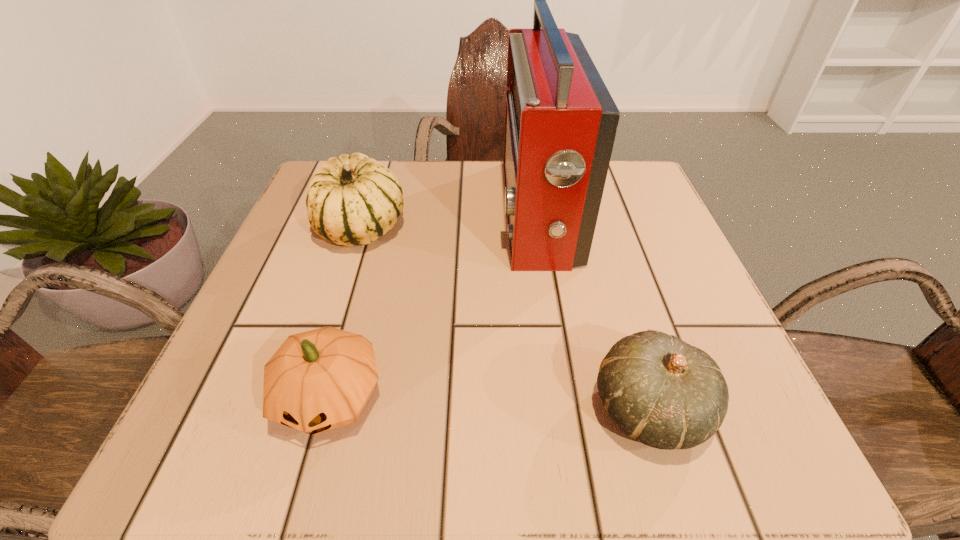
The width and height of the screenshot is (960, 540). What are the coordinates of `vacant space at the far right corner of the desktop` in the screenshot? It's located at (617, 185).

This screenshot has width=960, height=540. In order to click on empty location between the second tallest object and the rightmost gourd in this screenshot , I will do `click(506, 318)`.

Image resolution: width=960 pixels, height=540 pixels. I want to click on vacant point located between the farthest gourd and the rightmost gourd, so click(506, 318).

Where is `unoccupied area between the rightmost gourd and the farthest gourd`? The image size is (960, 540). unoccupied area between the rightmost gourd and the farthest gourd is located at coordinates (506, 318).

Where is `vacant space in between the radio receiver and the farthest gourd`? This screenshot has height=540, width=960. vacant space in between the radio receiver and the farthest gourd is located at coordinates (449, 220).

Identify the location of the second closest object to the tallest gourd. point(318,380).

Find the location of a particular element. The height and width of the screenshot is (540, 960). object that is the closest to the tallest object is located at coordinates (665, 393).

Choose which gourd is the nearest neighbor to the rightmost gourd. Please provide its 2D coordinates. Your answer should be formatted as a tuple, i.e. [(x, y)], where the tuple contains the x and y coordinates of a point satisfying the conditions above.

[(318, 380)]

Locate which gourd is the second closest to the rightmost gourd. Please provide its 2D coordinates. Your answer should be formatted as a tuple, i.e. [(x, y)], where the tuple contains the x and y coordinates of a point satisfying the conditions above.

[(353, 199)]

Locate an element on the screen. This screenshot has width=960, height=540. free location that satisfies the following two spatial constraints: 1. on the front-facing side of the rightmost gourd; 2. on the right side of the radio receiver is located at coordinates (567, 409).